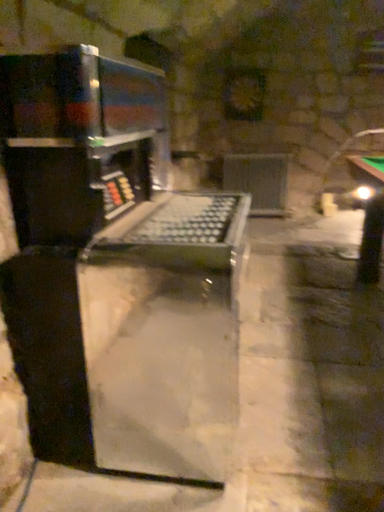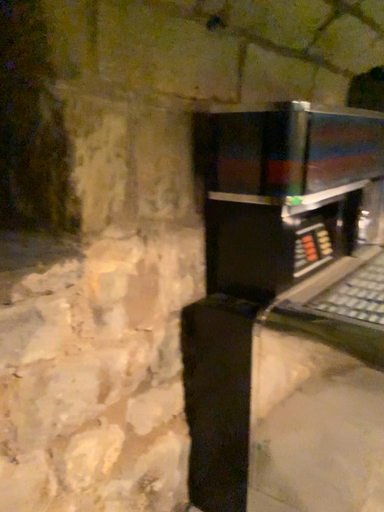
Question: How did the camera likely rotate when shooting the video?

Choices:
 (A) rotated right
 (B) rotated left

Answer: (B)